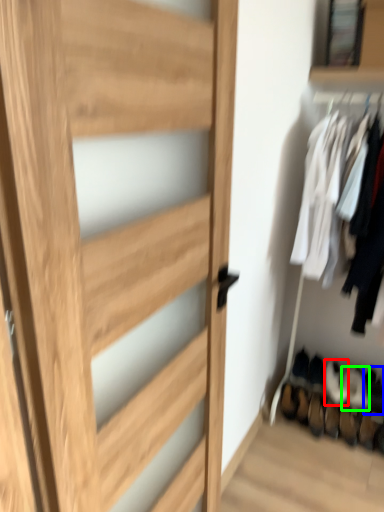
Question: Based on their relative distances, which object is nearer to shoe (highlighted by a red box)? Choose from shoe (highlighted by a blue box) and shoe (highlighted by a green box).

Choices:
 (A) shoe
 (B) shoe

Answer: (B)